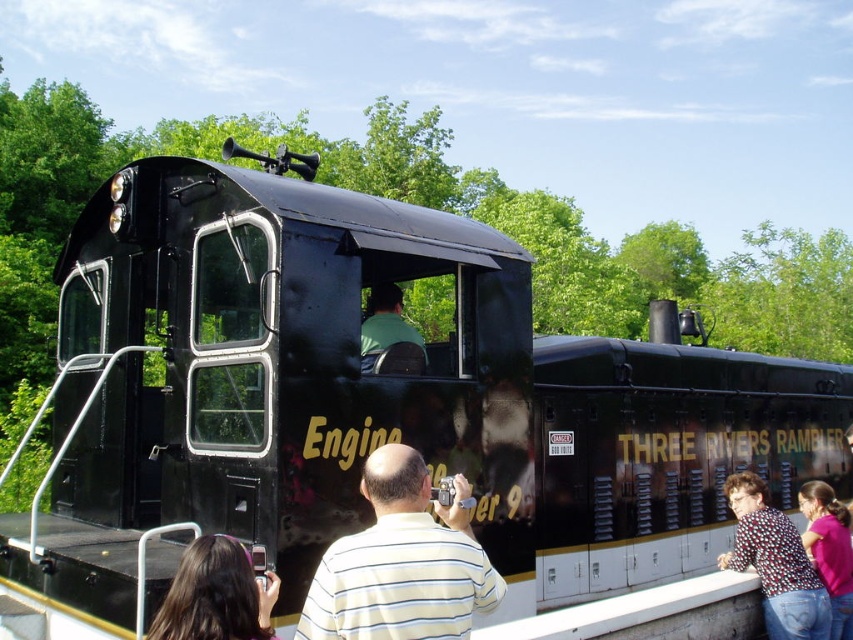
You are standing next to the printed fabric blouse at lower right and want to hand an item to the person holding the camera. Given that the distance between them is 17.05 feet, can you estimate whether you can comfortably hand the item without moving closer?

The printed fabric blouse at lower right and camera are 17.05 feet apart from each other. Since 17.05 feet is approximately 5.2 meters, which is quite a distance, you would need to move closer to comfortably hand the item to the person holding the camera.

You are standing in front of the black steam locomotive labeled Engine 9 and Three Rivers Rambler. You notice two points marked in the scene. Which of the two points, point (383,496) or point (811,612), is closer to you?

Point (383,496) is closer to the viewer than point (811,612).

You are a photographer standing near the locomotive and see the pink fabric shirt at lower right and the green matte shirt at center. Which person is closer to the ground?

The pink fabric shirt at lower right is located below green matte shirt at center, so the person wearing the pink fabric shirt at lower right is closer to the ground.